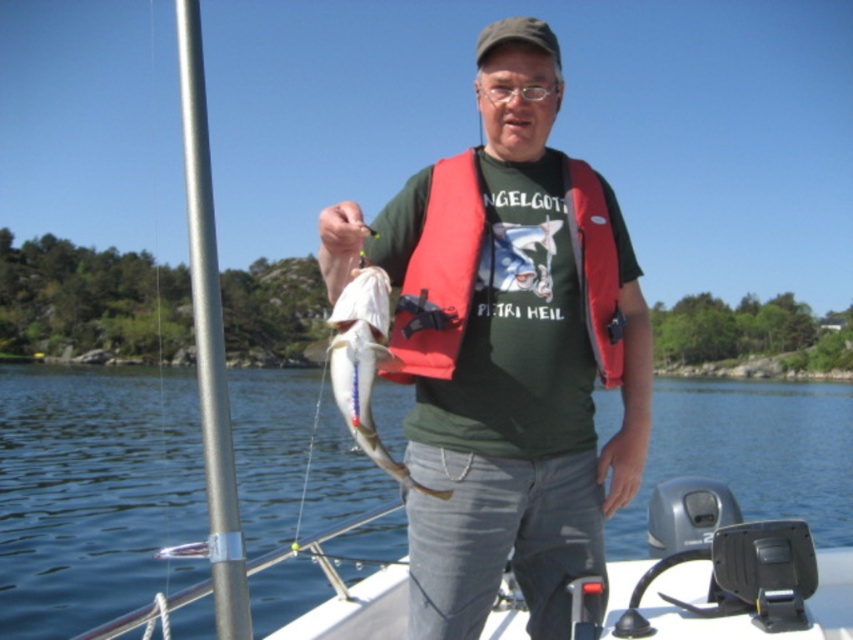
Does matte green t-shirt at center have a lesser height compared to shiny silver fish at center?

No.

Measure the distance from matte green t-shirt at center to shiny silver fish at center.

matte green t-shirt at center is 68.09 centimeters from shiny silver fish at center.

This screenshot has width=853, height=640. In order to click on matte green t-shirt at center in this screenshot , I will do [x=508, y=348].

Can you confirm if matte green t-shirt at center is smaller than brushed metal pole at left?

No.

Is matte green t-shirt at center positioned before brushed metal pole at left?

No, matte green t-shirt at center is behind brushed metal pole at left.

The height and width of the screenshot is (640, 853). I want to click on matte green t-shirt at center, so click(508, 348).

Who is positioned more to the left, matte green t-shirt at center or red fabric life jacket at center?

matte green t-shirt at center

Is matte green t-shirt at center positioned before red fabric life jacket at center?

Yes.

Is point (384, 237) farther from camera compared to point (405, 262)?

That is False.

Where is `matte green t-shirt at center`? The image size is (853, 640). matte green t-shirt at center is located at coordinates (508, 348).